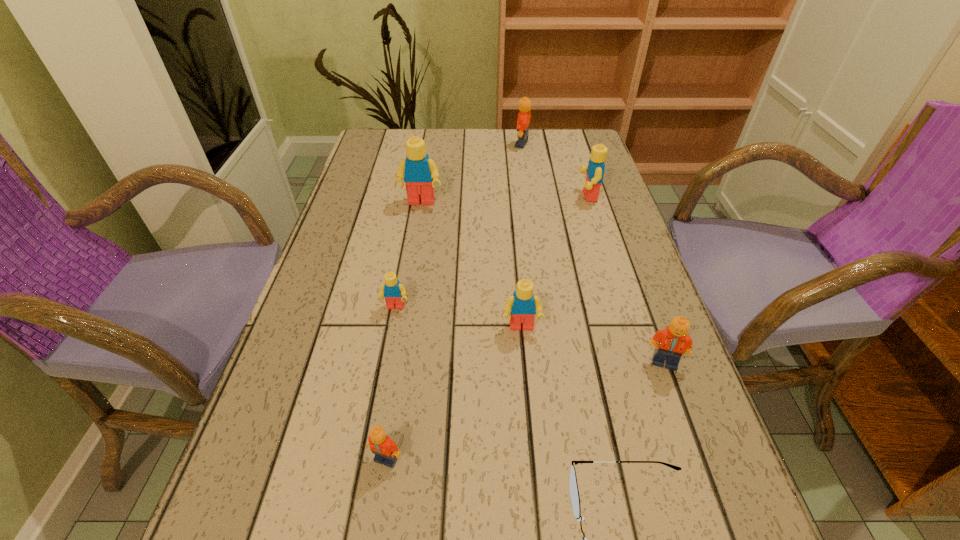
This screenshot has width=960, height=540. Identify the location of free space between the rightmost yellow Lego and the third nearest Lego. (555, 262).

The height and width of the screenshot is (540, 960). In order to click on vacant region between the smallest yellow Lego and the tallest Lego in this screenshot , I will do `click(408, 255)`.

Locate an element on the screen. vacant space that's between the tallest Lego and the biggest orange Lego is located at coordinates (471, 173).

Locate an element on the screen. This screenshot has height=540, width=960. free space between the biggest orange Lego and the rightmost yellow Lego is located at coordinates (555, 170).

Image resolution: width=960 pixels, height=540 pixels. Identify the location of free spot between the tallest object and the rightmost yellow Lego. (504, 199).

You are a GUI agent. You are given a task and a screenshot of the screen. Output one action in this format:
    pyautogui.click(x=<x>, y=<y>)
    Task: Click on the vacant space that is in between the biggest orange Lego and the tallest Lego
    The height and width of the screenshot is (540, 960).
    Given the screenshot: What is the action you would take?
    pyautogui.click(x=471, y=173)

Locate an element on the screen. This screenshot has width=960, height=540. empty location between the fifth nearest object and the biggest yellow Lego is located at coordinates (408, 255).

Point out which object is positioned as the fifth nearest to the third yellow Lego from left to right. Please provide its 2D coordinates. Your answer should be formatted as a tuple, i.e. [(x, y)], where the tuple contains the x and y coordinates of a point satisfying the conditions above.

[(418, 171)]

This screenshot has width=960, height=540. Identify the location of object that is the fifth closest to the sixth farthest Lego. (594, 170).

Locate an element on the screen. The height and width of the screenshot is (540, 960). the fourth closest Lego to the third smallest yellow Lego is located at coordinates (673, 341).